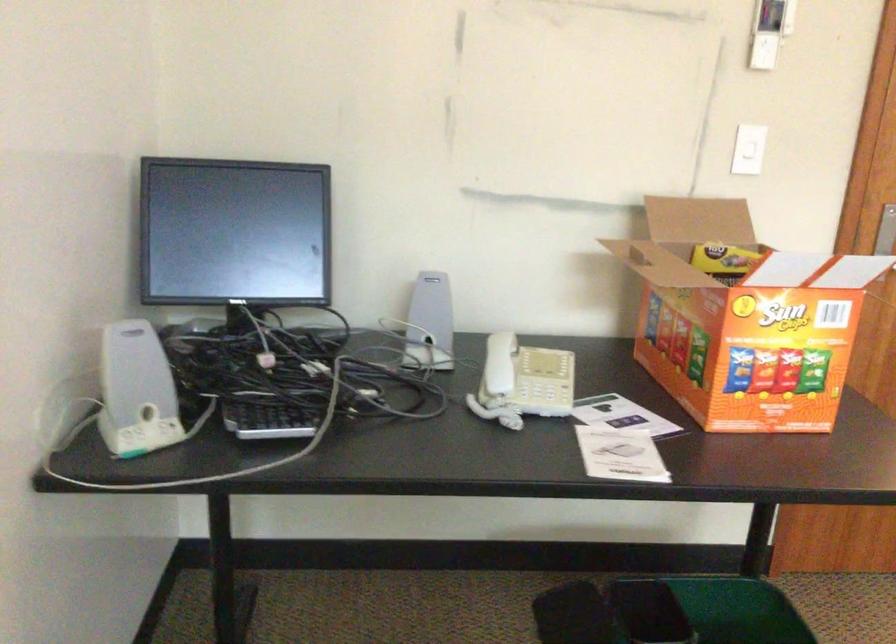
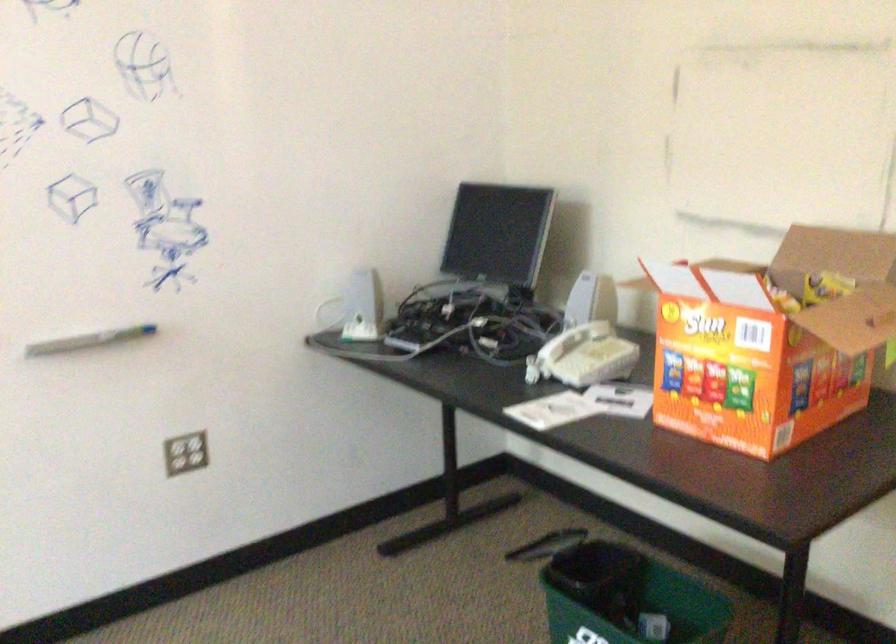
In the second image, find the point that corresponds to pixel 746 258 in the first image.

(824, 287)